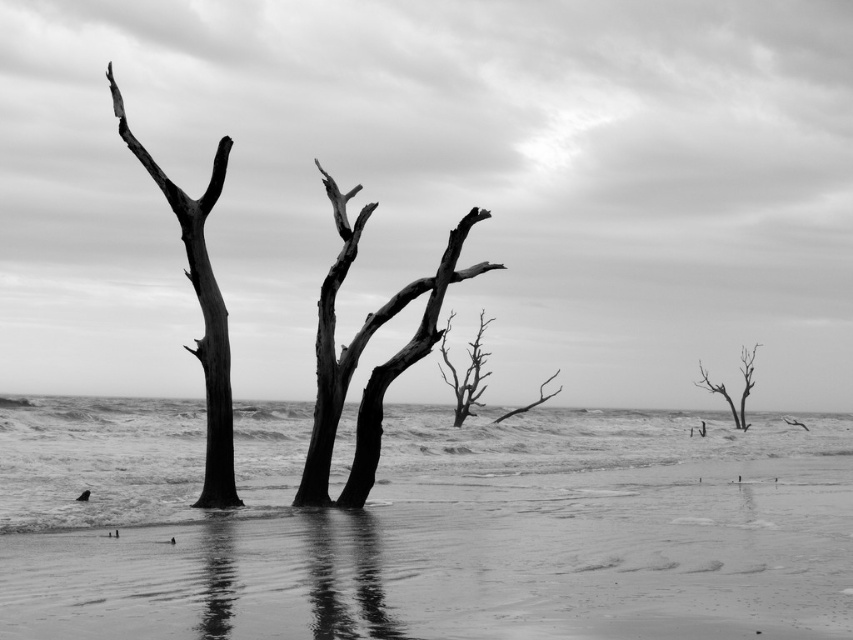
Question: Does smooth water at center have a smaller size compared to dark gray bark tree at left?

Choices:
 (A) yes
 (B) no

Answer: (B)

Question: Which point is closer to the camera taking this photo?

Choices:
 (A) (445, 362)
 (B) (735, 413)
 (C) (216, 353)

Answer: (C)

Question: Which point appears closest to the camera in this image?

Choices:
 (A) (717, 392)
 (B) (379, 410)
 (C) (200, 268)

Answer: (C)

Question: Which point is closer to the camera?

Choices:
 (A) smooth bark tree at center
 (B) dark gray bark tree at left
 (C) smooth bark tree at right
 (D) dead wood tree at center

Answer: (B)

Question: From the image, what is the correct spatial relationship of dark gray bark tree at left in relation to smooth bark tree at right?

Choices:
 (A) below
 (B) above

Answer: (B)

Question: Can you confirm if smooth bark tree at center is wider than dark gray bark tree at left?

Choices:
 (A) yes
 (B) no

Answer: (A)